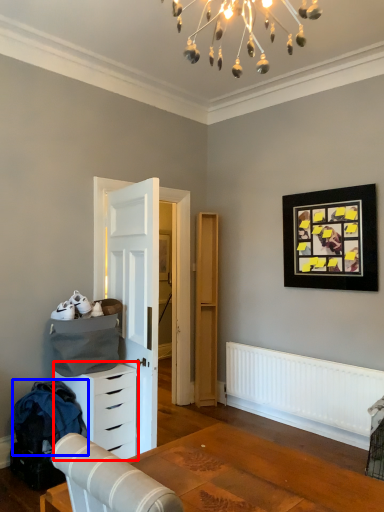
Question: Which object appears farthest to the camera in this image, chest of drawers (highlighted by a red box) or laundry (highlighted by a blue box)?

Choices:
 (A) chest of drawers
 (B) laundry

Answer: (A)